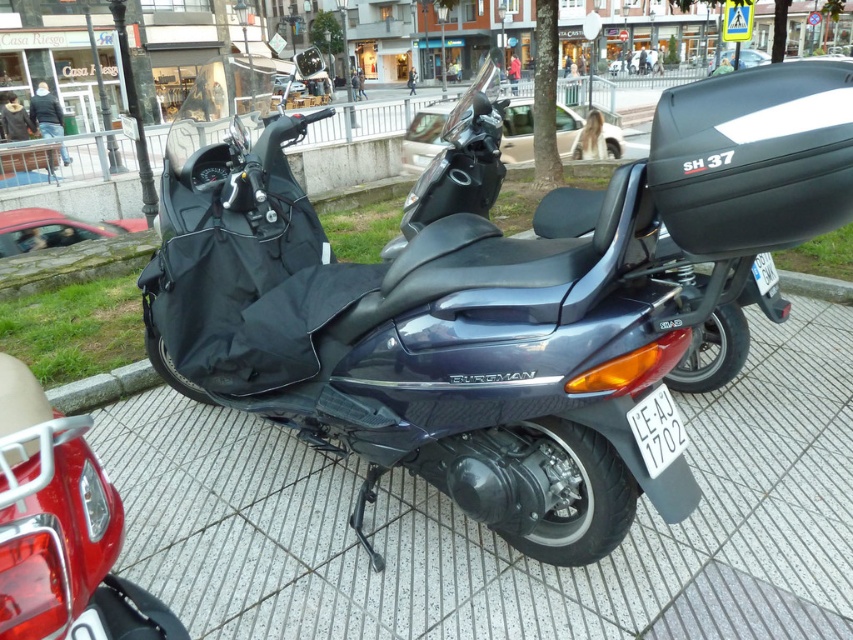
Between matte black bag at lower left and black plastic license plate at lower center, which one is positioned higher?

black plastic license plate at lower center is higher up.

Who is more distant from viewer, (65, 616) or (640, 403)?

Positioned behind is point (640, 403).

I want to click on matte black bag at lower left, so click(61, 529).

In order to click on matte black bag at lower left in this screenshot , I will do `click(61, 529)`.

Is point (207, 321) behind point (670, 454)?

Yes, point (207, 321) is farther from viewer.

Who is lower down, satin black scooter at center or black plastic license plate at lower center?

black plastic license plate at lower center is below.

What do you see at coordinates (496, 300) in the screenshot? I see `satin black scooter at center` at bounding box center [496, 300].

At what (x,y) coordinates should I click in order to perform the action: click on satin black scooter at center. Please return your answer as a coordinate pair (x, y). The height and width of the screenshot is (640, 853). Looking at the image, I should click on (496, 300).

Is point (587, 570) farther from viewer compared to point (59, 524)?

Yes, it is.

Between point (548, 634) and point (82, 483), which one is positioned in front?

Point (82, 483) is in front.

Where is `gray textured pavement at center`? gray textured pavement at center is located at coordinates (486, 529).